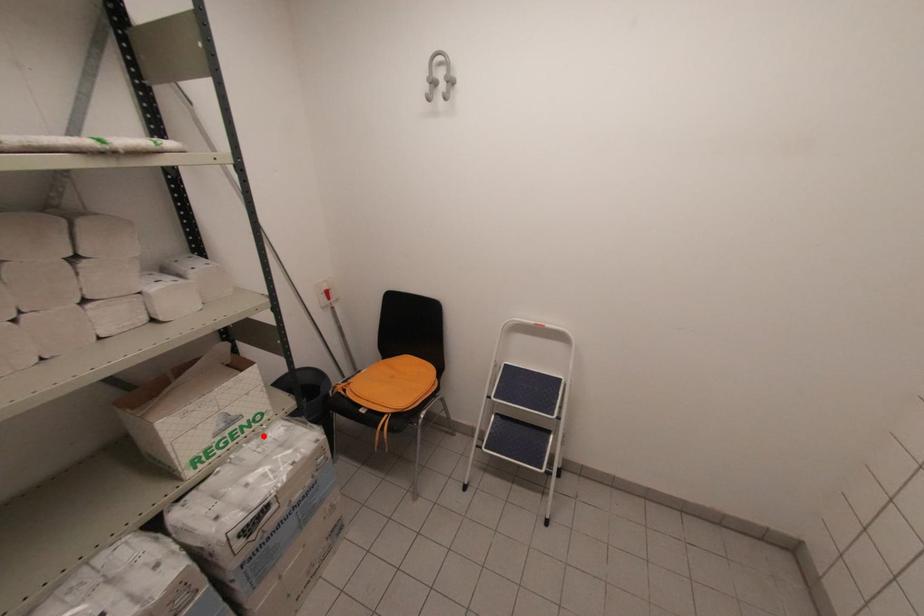
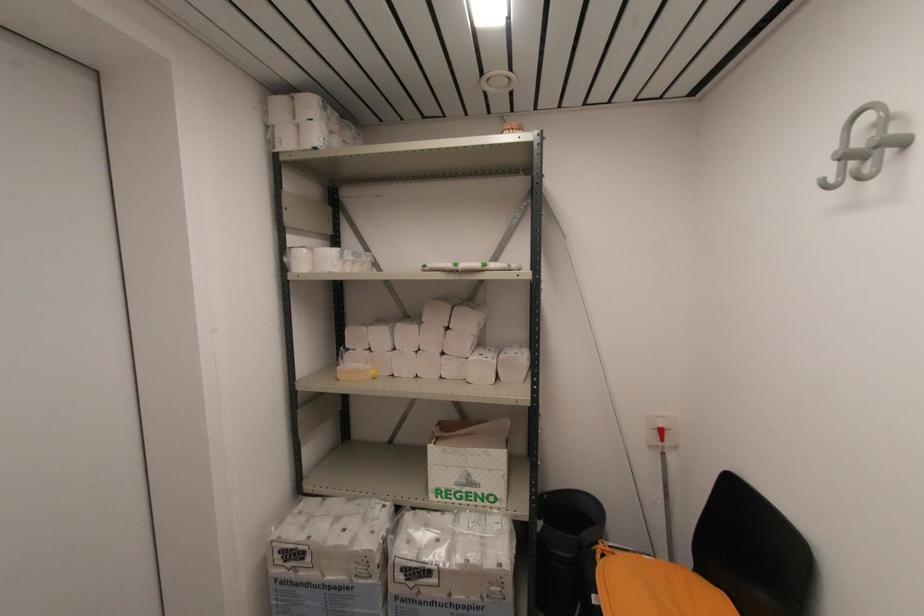
Question: I am providing you with two images of the same scene from different viewpoints. Image1 has a red point marked. In image2, the corresponding 3D location appears at what relative position? Reply with the corresponding letter.

Choices:
 (A) Closer
 (B) Farther

Answer: (B)